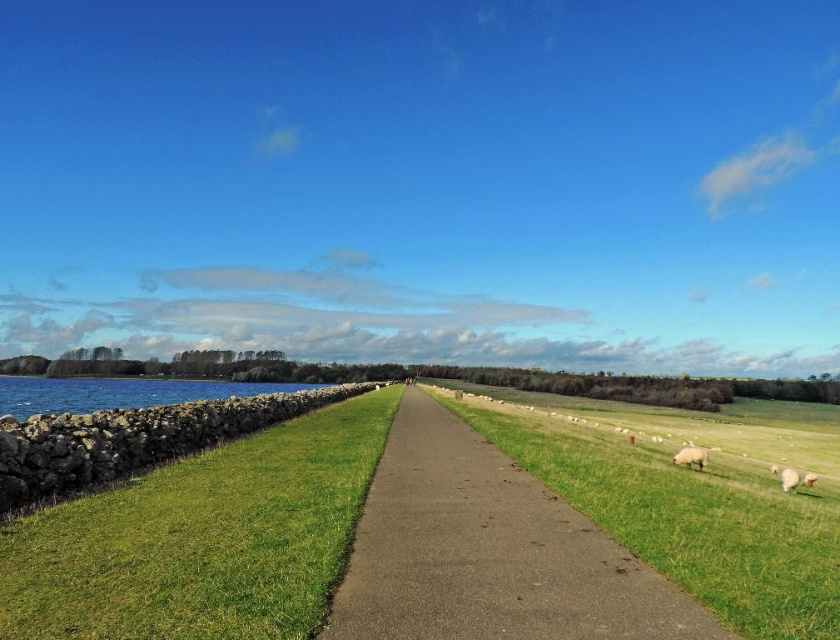
Between smooth concrete path at center and white woolly sheep at lower right, which one has less height?

With less height is white woolly sheep at lower right.

Does smooth concrete path at center have a greater width compared to white woolly sheep at lower right?

Yes, smooth concrete path at center is wider than white woolly sheep at lower right.

Between point (526, 504) and point (697, 449), which one is positioned in front?

Positioned in front is point (526, 504).

Locate an element on the screen. smooth concrete path at center is located at coordinates (489, 552).

Is white woolly sheep at lower right to the right of white fluffy sheep at lower right from the viewer's perspective?

In fact, white woolly sheep at lower right is to the left of white fluffy sheep at lower right.

Is point (691, 460) more distant than point (773, 467)?

No, it is not.

The width and height of the screenshot is (840, 640). Identify the location of white woolly sheep at lower right. (690, 458).

Measure the distance from green grass at left to white fluffy sheep at lower right.

A distance of 25.60 meters exists between green grass at left and white fluffy sheep at lower right.

In the scene shown: Measure the distance between green grass at left and white fluffy sheep at lower right.

green grass at left is 25.60 meters from white fluffy sheep at lower right.

The width and height of the screenshot is (840, 640). Identify the location of green grass at left. (201, 538).